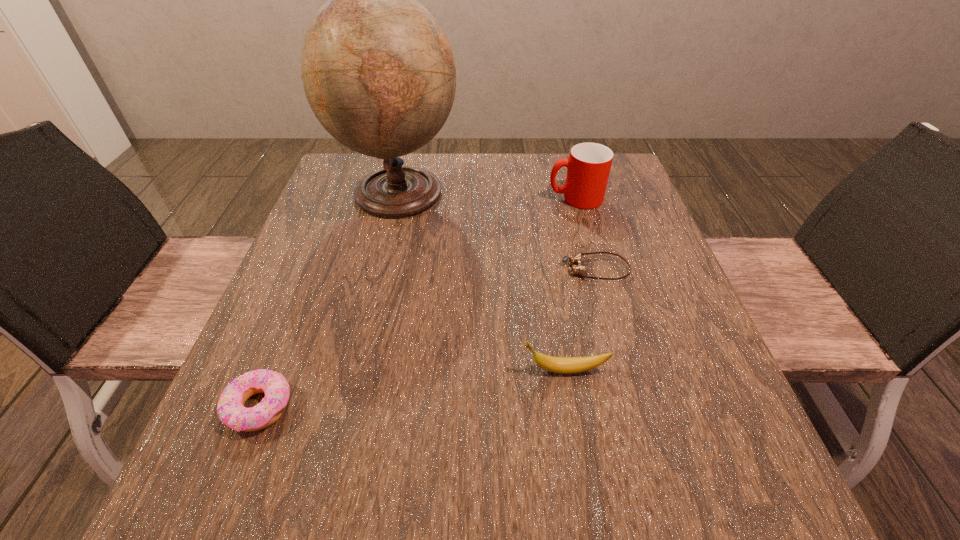
You are a GUI agent. You are given a task and a screenshot of the screen. Output one action in this format:
    pyautogui.click(x=<x>, y=<y>)
    Task: Click on the cup that is at the far edge
    The height and width of the screenshot is (540, 960).
    Given the screenshot: What is the action you would take?
    pyautogui.click(x=588, y=167)

I want to click on globe situated at the left edge, so click(x=378, y=71).

The image size is (960, 540). In order to click on doughnut present at the left edge in this screenshot , I will do `click(230, 408)`.

Identify the location of cup present at the right edge. (588, 167).

The image size is (960, 540). I want to click on goggles at the right edge, so click(x=575, y=260).

Locate an element on the screen. This screenshot has width=960, height=540. object that is at the far left corner is located at coordinates (378, 71).

At what (x,y) coordinates should I click in order to perform the action: click on object located in the far right corner section of the desktop. Please return your answer as a coordinate pair (x, y). Looking at the image, I should click on (588, 167).

This screenshot has height=540, width=960. In order to click on vacant space at the far edge of the desktop in this screenshot , I will do `click(548, 170)`.

Image resolution: width=960 pixels, height=540 pixels. I want to click on vacant space at the near edge of the desktop, so click(x=346, y=485).

Where is `vacant region at the left edge of the desktop`? Image resolution: width=960 pixels, height=540 pixels. vacant region at the left edge of the desktop is located at coordinates (303, 458).